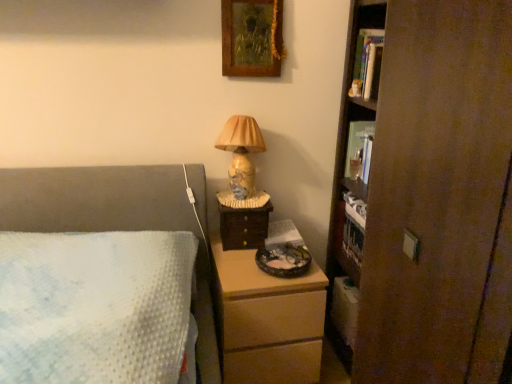
Question: Is wooden drawer at right wider than wooden chest of drawers at lower center?

Choices:
 (A) no
 (B) yes

Answer: (A)

Question: Is wooden drawer at right to the right of wooden chest of drawers at lower center from the viewer's perspective?

Choices:
 (A) yes
 (B) no

Answer: (B)

Question: Does wooden drawer at right have a smaller size compared to wooden chest of drawers at lower center?

Choices:
 (A) no
 (B) yes

Answer: (B)

Question: Is wooden drawer at right thinner than wooden chest of drawers at lower center?

Choices:
 (A) no
 (B) yes

Answer: (B)

Question: Is wooden drawer at right not near wooden chest of drawers at lower center?

Choices:
 (A) yes
 (B) no

Answer: (B)

Question: From a real-world perspective, is hardcover book at upper right, which ranks as the 1th book in bottom-to-top order, above or below wooden drawer at right?

Choices:
 (A) above
 (B) below

Answer: (A)

Question: Considering their positions, is hardcover book at upper right, which ranks as the 1th book in bottom-to-top order, located in front of or behind wooden drawer at right?

Choices:
 (A) behind
 (B) front

Answer: (A)

Question: From the image's perspective, is hardcover book at upper right, which is the 2th book from front to back, above or below wooden drawer at right?

Choices:
 (A) below
 (B) above

Answer: (B)

Question: Would you say hardcover book at upper right, which is the 2th book in top-to-bottom order, is to the left or to the right of wooden drawer at right in the picture?

Choices:
 (A) right
 (B) left

Answer: (A)

Question: From a real-world perspective, is matte ceramic lamp at center above or below wooden chest of drawers at lower center?

Choices:
 (A) below
 (B) above

Answer: (B)

Question: Considering the positions of point (246, 168) and point (222, 367), is point (246, 168) closer or farther from the camera than point (222, 367)?

Choices:
 (A) farther
 (B) closer

Answer: (A)

Question: Looking at the image, does matte ceramic lamp at center seem bigger or smaller compared to wooden chest of drawers at lower center?

Choices:
 (A) big
 (B) small

Answer: (B)

Question: In the image, is matte ceramic lamp at center on the left side or the right side of wooden chest of drawers at lower center?

Choices:
 (A) right
 (B) left

Answer: (B)

Question: Is matte ceramic lamp at center in front of or behind white plush cat at upper right in the image?

Choices:
 (A) behind
 (B) front

Answer: (B)

Question: From a real-world perspective, is matte ceramic lamp at center physically located above or below white plush cat at upper right?

Choices:
 (A) below
 (B) above

Answer: (A)